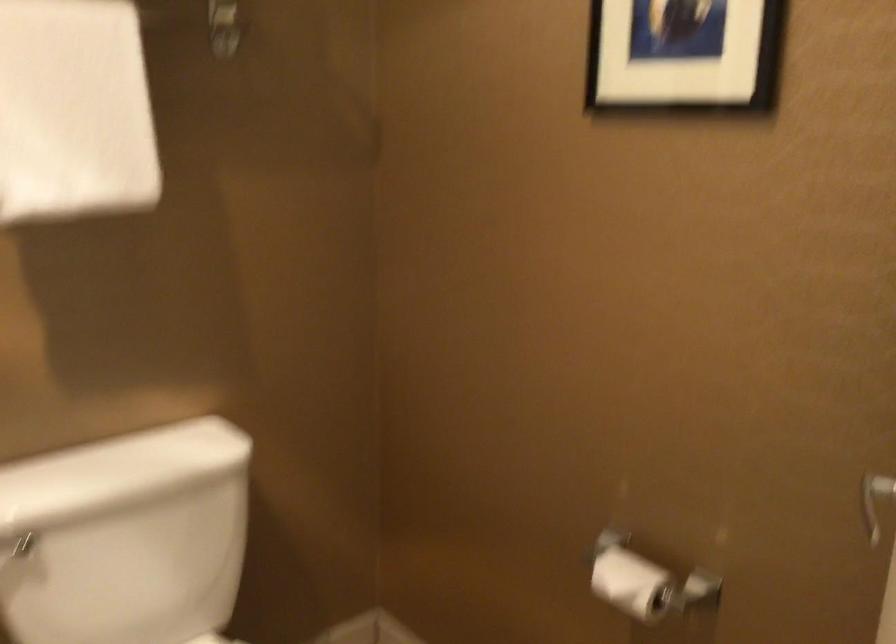
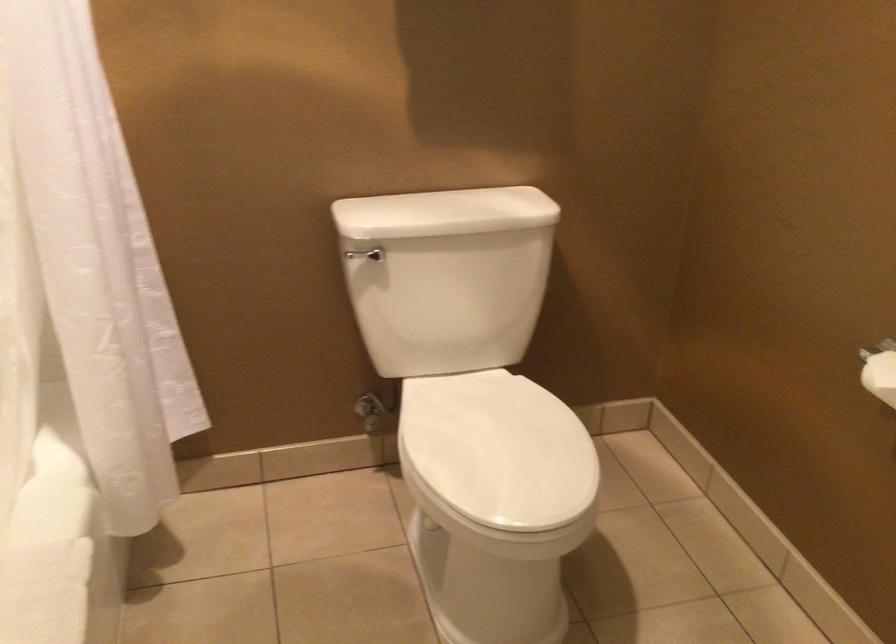
Which direction would the cameraman need to move to produce the second image?

The cameraman walked toward right, backward.